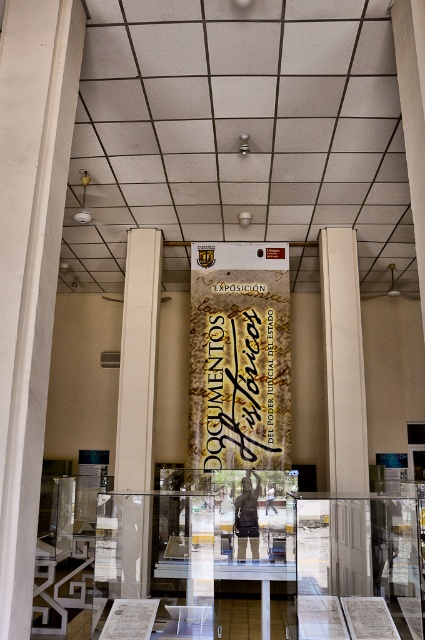
Question: Based on their relative distances, which object is nearer to the beige concrete pillar at center?

Choices:
 (A) gold calligraphy banner at center
 (B) white smooth pillar at center

Answer: (A)

Question: Among these points, which one is nearest to the camera?

Choices:
 (A) (135, 547)
 (B) (368, 541)
 (C) (257, 316)

Answer: (A)

Question: Observing the image, what is the correct spatial positioning of white smooth pillar at center in reference to gold calligraphy banner at center?

Choices:
 (A) below
 (B) above

Answer: (B)

Question: Which object is farther from the camera taking this photo?

Choices:
 (A) beige concrete pillar at center
 (B) gold calligraphy banner at center
 (C) white smooth pillar at center

Answer: (B)

Question: Can you confirm if beige concrete pillar at center is wider than white smooth pillar at center?

Choices:
 (A) yes
 (B) no

Answer: (A)

Question: Does white smooth pillar at center appear on the left side of gold calligraphy banner at center?

Choices:
 (A) yes
 (B) no

Answer: (A)